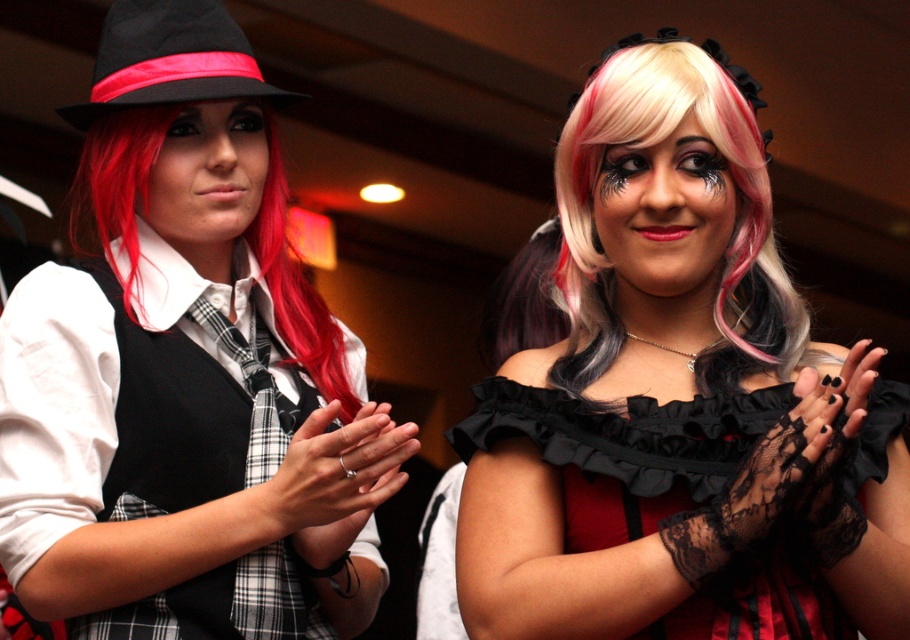
Question: Does matte black dress at center have a lesser width compared to blonde and pink wig at center?

Choices:
 (A) yes
 (B) no

Answer: (B)

Question: Which object is positioned closest to the matte black hat at upper left?

Choices:
 (A) blonde and pink wig at center
 (B) shiny red hair at left
 (C) matte black dress at center
 (D) black felt hat at left

Answer: (B)

Question: Is matte black dress at center further to camera compared to matte black hat at upper left?

Choices:
 (A) no
 (B) yes

Answer: (A)

Question: Which point appears closest to the camera in this image?

Choices:
 (A) (95, 108)
 (B) (723, 422)

Answer: (B)

Question: Does blonde and pink wig at center appear over black felt hat at left?

Choices:
 (A) yes
 (B) no

Answer: (B)

Question: Which point is closer to the camera taking this photo?

Choices:
 (A) (113, 72)
 (B) (787, 339)
 (C) (231, 195)

Answer: (B)